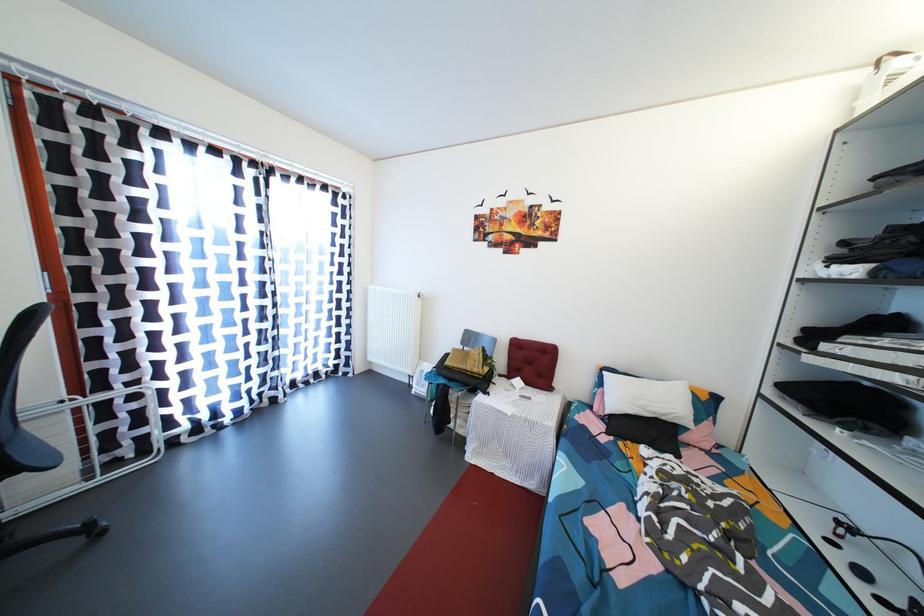
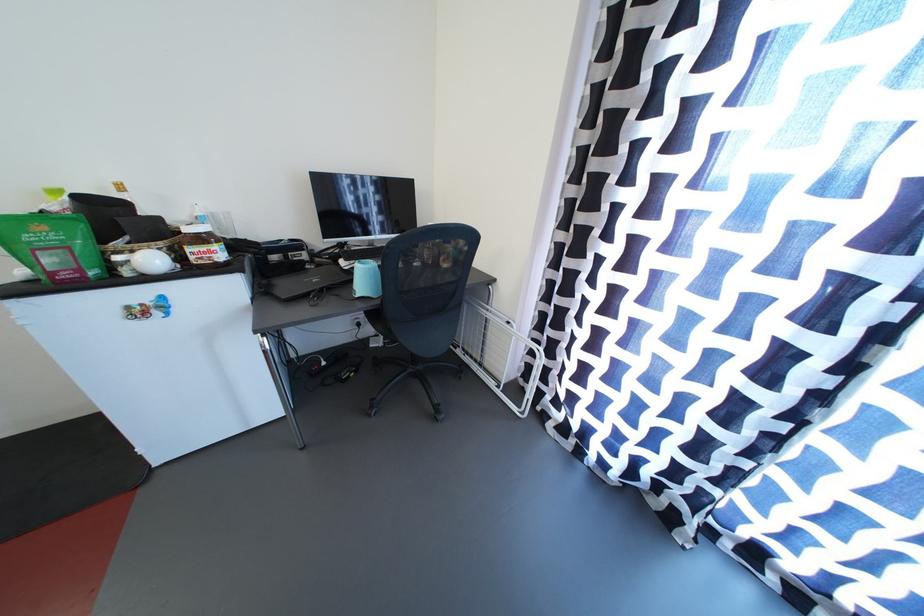
Where in the second image is the point corresponding to point 106,485 from the first image?

(505, 397)